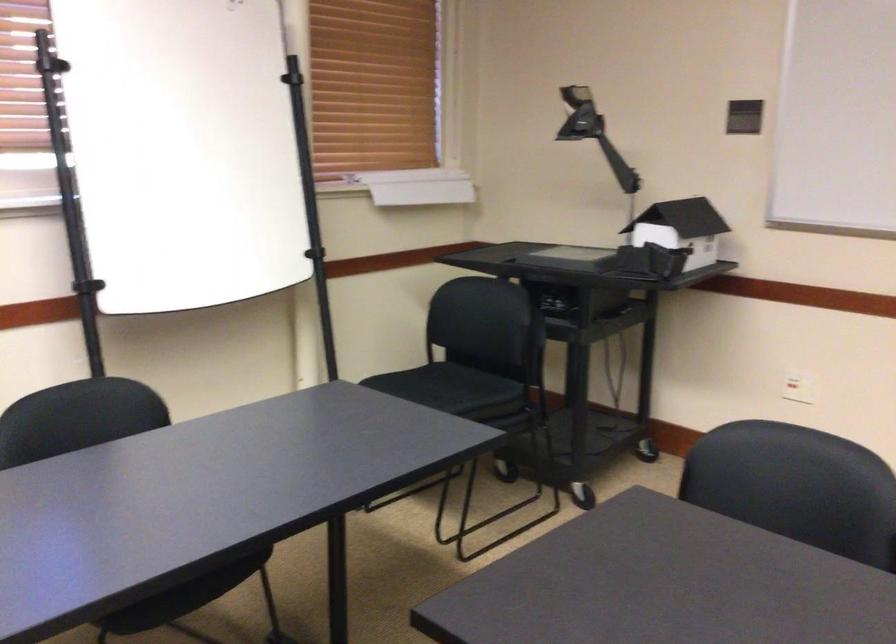
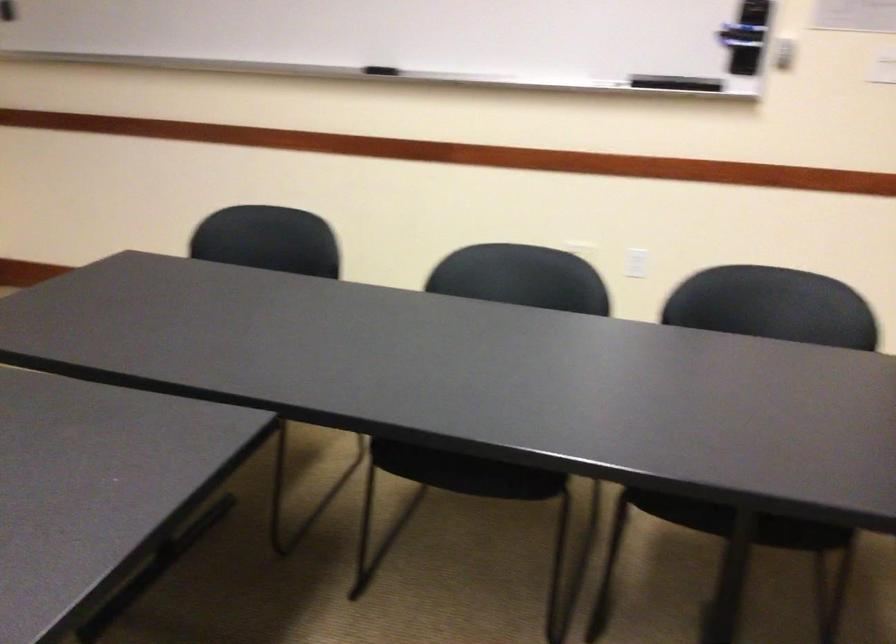
First-person continuous shooting, in which direction is the camera rotating?

The camera rotated toward right-down.